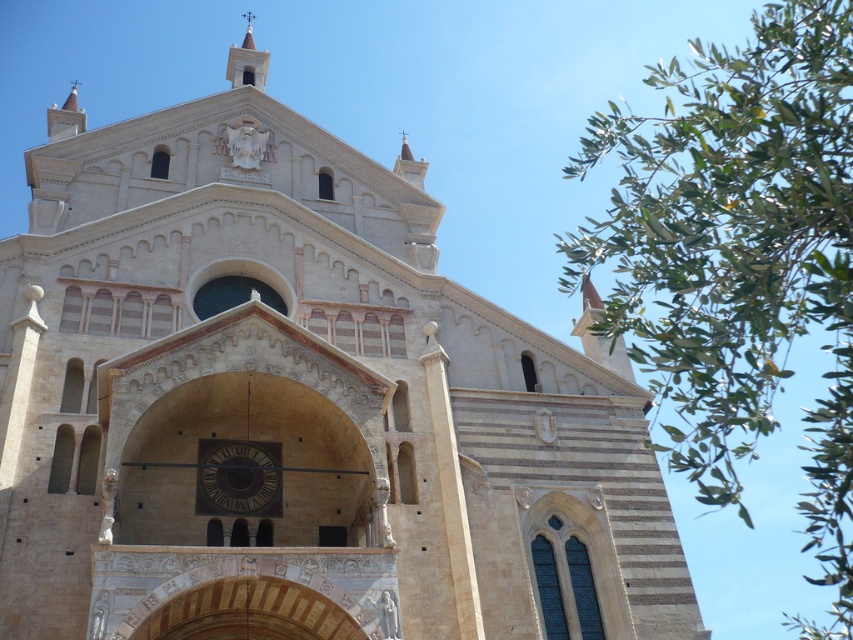
Which of these two, green leafy tree at upper right or dark brown wooden clock at center, stands shorter?

dark brown wooden clock at center

Does point (773, 422) come in front of point (270, 461)?

Yes.

Find the location of a particular element. green leafy tree at upper right is located at coordinates (740, 259).